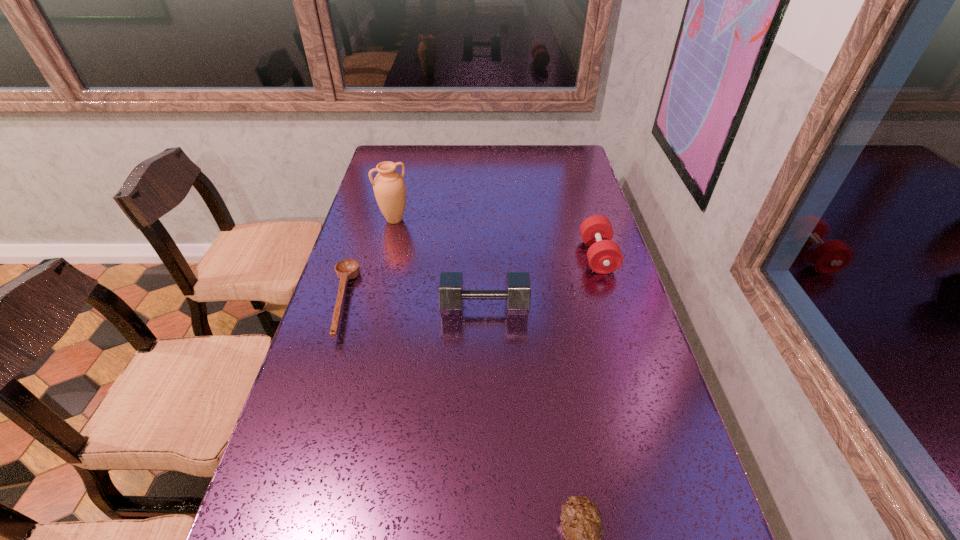
Identify the location of empty space between the wooden spoon and the left dumbbell. This screenshot has width=960, height=540. (412, 305).

Locate an element on the screen. The width and height of the screenshot is (960, 540). free space between the fourth object from right to left and the left dumbbell is located at coordinates (440, 264).

The height and width of the screenshot is (540, 960). Find the location of `free space between the nearer dumbbell and the farthest object`. free space between the nearer dumbbell and the farthest object is located at coordinates (440, 264).

You are a GUI agent. You are given a task and a screenshot of the screen. Output one action in this format:
    pyautogui.click(x=<x>, y=<y>)
    Task: Click on the object that is the second closest to the rightmost object
    The width and height of the screenshot is (960, 540).
    Given the screenshot: What is the action you would take?
    pyautogui.click(x=389, y=187)

Image resolution: width=960 pixels, height=540 pixels. What are the coordinates of `object that is the fourth closest one to the nearer dumbbell` in the screenshot? It's located at (581, 520).

The image size is (960, 540). In order to click on free location that satisfies the following two spatial constraints: 1. on the front side of the right dumbbell; 2. on the left side of the urn in this screenshot , I will do `click(386, 256)`.